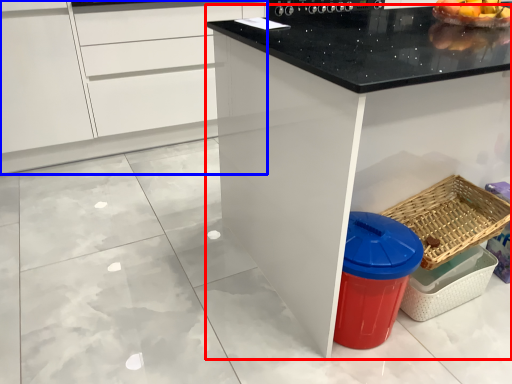
Question: Which object is further to the camera taking this photo, countertop (highlighted by a red box) or cabinetry (highlighted by a blue box)?

Choices:
 (A) countertop
 (B) cabinetry

Answer: (B)